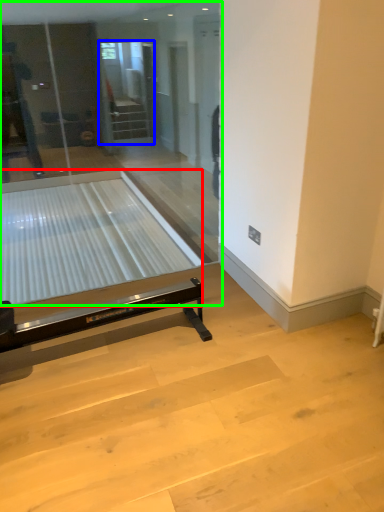
Question: Estimate the real-world distances between objects in this image. Which object is farther from glass table (highlighted by a red box), screen door (highlighted by a blue box) or glass door (highlighted by a green box)?

Choices:
 (A) screen door
 (B) glass door

Answer: (A)